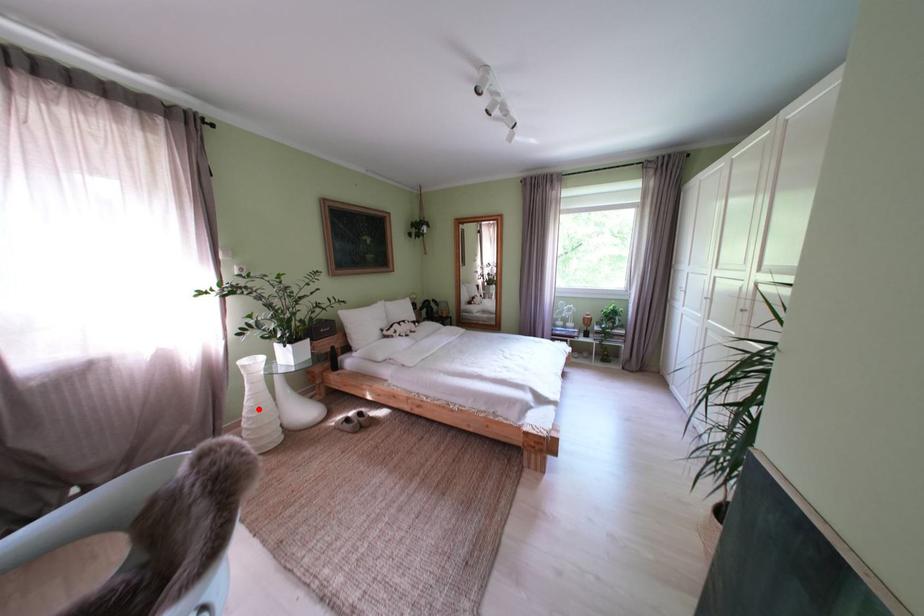
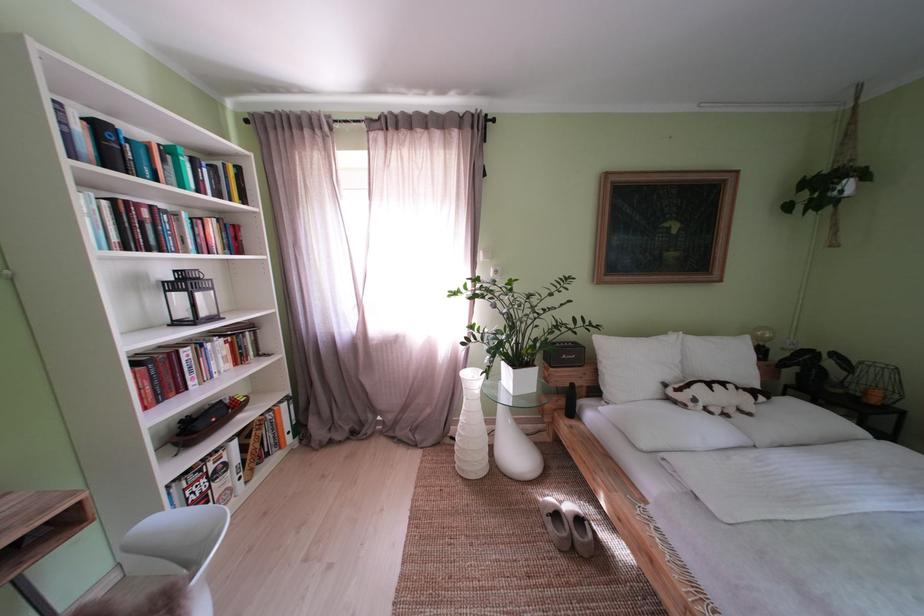
Question: I am providing you with two images of the same scene from different viewpoints. A red point is shown in image1. For the corresponding object point in image2, is it positioned nearer or farther from the camera?

Choices:
 (A) Nearer
 (B) Farther

Answer: (B)